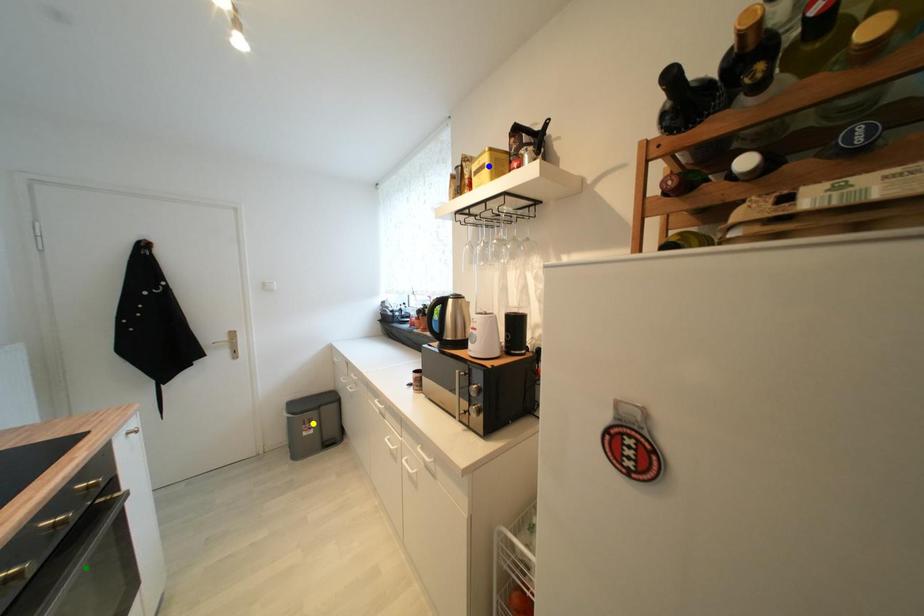
Order these from farthest to nearest:
1. green point
2. yellow point
3. blue point

yellow point → blue point → green point